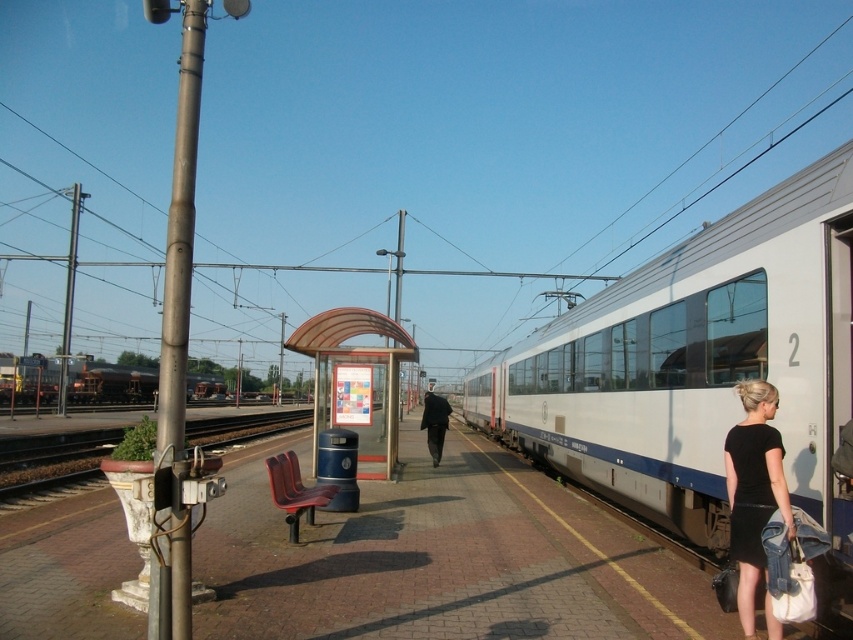
Is point (19, 385) closer to camera compared to point (230, 438)?

That is False.

Measure the distance between dark gray metal train at left and brown wooden train track at lower left.

dark gray metal train at left is 12.52 meters away from brown wooden train track at lower left.

Image resolution: width=853 pixels, height=640 pixels. What are the coordinates of `dark gray metal train at left` in the screenshot? It's located at (109, 381).

Can you confirm if red plastic bench at center is taller than brown wooden train track at lower left?

In fact, red plastic bench at center may be shorter than brown wooden train track at lower left.

You are a GUI agent. You are given a task and a screenshot of the screen. Output one action in this format:
    pyautogui.click(x=<x>, y=<y>)
    Task: Click on the red plastic bench at center
    This screenshot has width=853, height=640.
    Given the screenshot: What is the action you would take?
    pyautogui.click(x=363, y=365)

Which is behind, point (358, 442) or point (45, 474)?

Positioned behind is point (45, 474).

Locate an element on the screen. The image size is (853, 640). red plastic bench at center is located at coordinates (363, 365).

Does white glossy train at right lie in front of black matte dress at lower right?

No, white glossy train at right is behind black matte dress at lower right.

Between point (851, 202) and point (762, 499), which one is positioned in front?

Positioned in front is point (762, 499).

At what (x,y) coordinates should I click in order to perform the action: click on white glossy train at right. Please return your answer as a coordinate pair (x, y). This screenshot has width=853, height=640. Looking at the image, I should click on (700, 369).